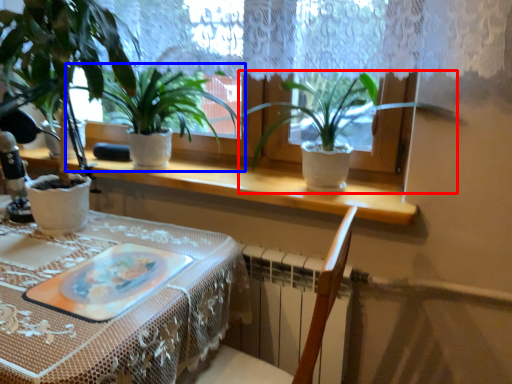
Question: Among these objects, which one is nearest to the camera, houseplant (highlighted by a red box) or houseplant (highlighted by a blue box)?

Choices:
 (A) houseplant
 (B) houseplant

Answer: (A)